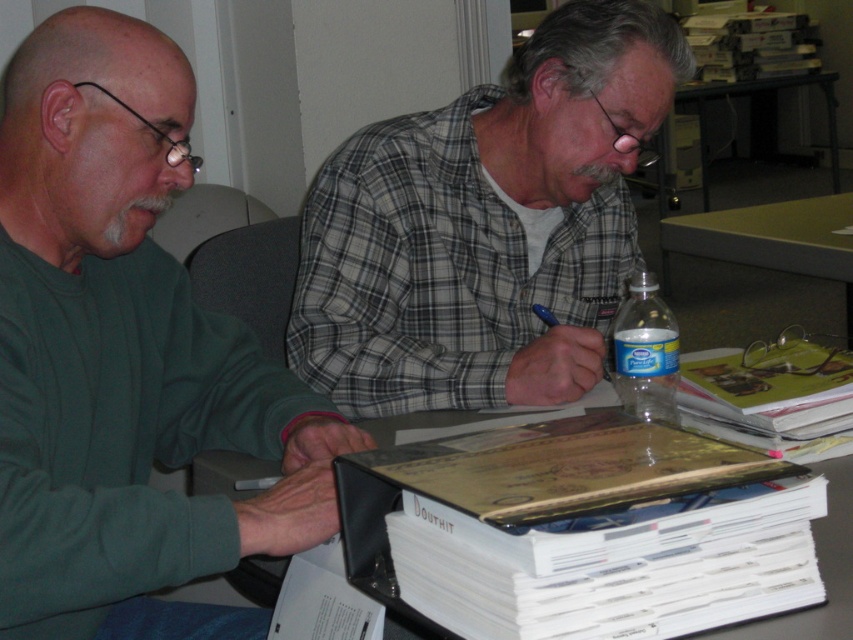
Is green matte sweater at left thinner than white paper at center?

Yes.

Is point (132, 445) positioned before point (496, 422)?

Yes.

Identify the location of green matte sweater at left. (126, 358).

Which is more to the left, plaid shirt at center or white paper at center?

plaid shirt at center is more to the left.

Image resolution: width=853 pixels, height=640 pixels. I want to click on plaid shirt at center, so click(486, 225).

Is green matte sweater at left smaller than clear plastic bottle at center?

No, green matte sweater at left is not smaller than clear plastic bottle at center.

Who is more forward, (109,58) or (657,340)?

Point (109,58)

Where is `green matte sweater at left`? green matte sweater at left is located at coordinates (126, 358).